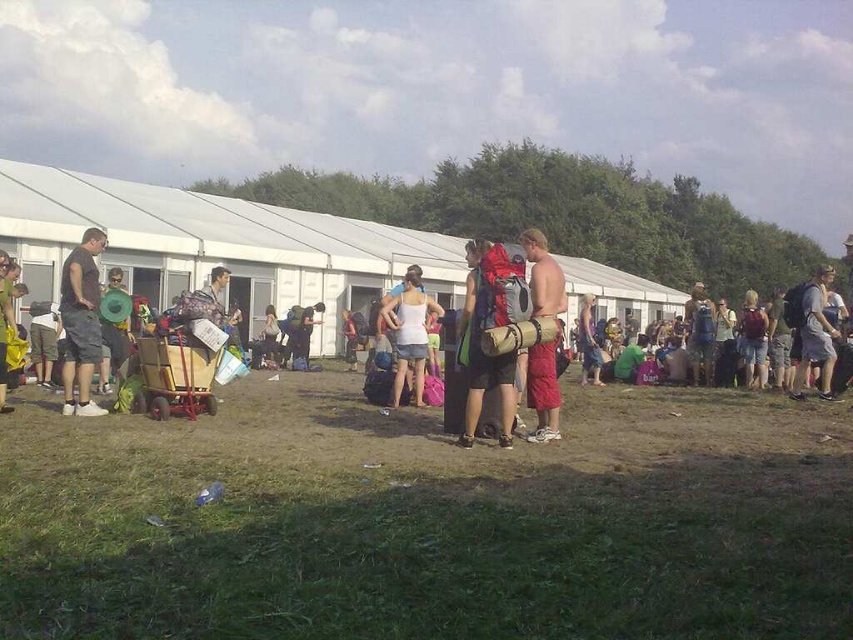
Between matte gray backpack at center and matte black t-shirt at left, which one has less height?

matte black t-shirt at left is shorter.

Is matte gray backpack at center bigger than matte black t-shirt at left?

Indeed, matte gray backpack at center has a larger size compared to matte black t-shirt at left.

Is point (489, 266) behind point (78, 285)?

No, (489, 266) is in front of (78, 285).

Where is `matte gray backpack at center`? The width and height of the screenshot is (853, 640). matte gray backpack at center is located at coordinates (480, 332).

From the picture: Is shiny metallic drum at center thinner than matte black backpack at center?

No, shiny metallic drum at center is not thinner than matte black backpack at center.

Which is in front, point (548, 364) or point (317, 323)?

Point (548, 364) is in front.

Where is `shiny metallic drum at center`? Image resolution: width=853 pixels, height=640 pixels. shiny metallic drum at center is located at coordinates tap(543, 392).

Is shiny metallic drum at center behind white matte tank top at center?

No.

The image size is (853, 640). Identify the location of shiny metallic drum at center. (543, 392).

Who is more distant from viewer, (535, 346) or (421, 400)?

Point (421, 400)

Where is `shiny metallic drum at center`? The width and height of the screenshot is (853, 640). shiny metallic drum at center is located at coordinates (543, 392).